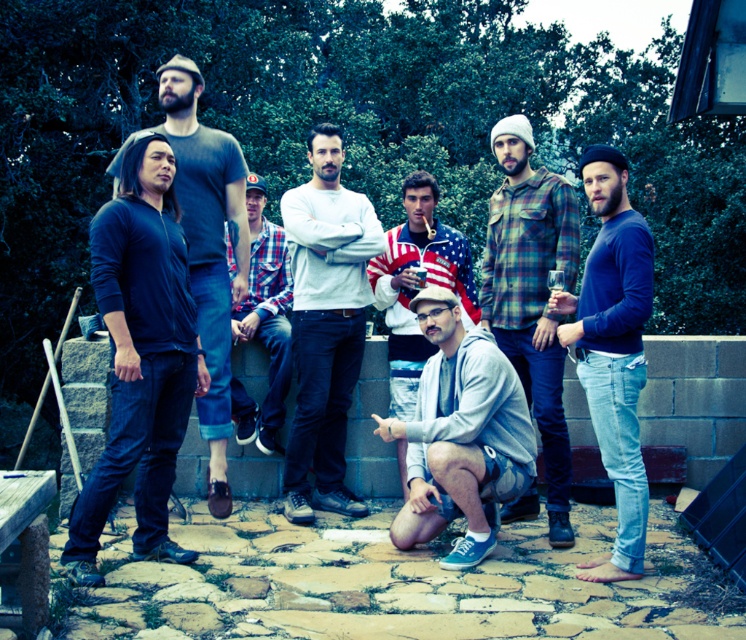
This screenshot has width=746, height=640. Describe the element at coordinates (140, 356) in the screenshot. I see `dark blue sweater at left` at that location.

In the scene shown: Between dark blue sweater at left and plaid flannel shirt at center, which one is positioned lower?

dark blue sweater at left is below.

Between point (95, 554) and point (514, 296), which one is positioned in front?

Positioned in front is point (95, 554).

The width and height of the screenshot is (746, 640). I want to click on dark blue sweater at left, so click(140, 356).

Is white matte sweater at center below plaid fabric shirt at center?

Yes, white matte sweater at center is below plaid fabric shirt at center.

In the scene shown: Can you confirm if white matte sweater at center is taller than plaid fabric shirt at center?

Correct, white matte sweater at center is much taller as plaid fabric shirt at center.

Which is behind, point (330, 420) or point (283, 336)?

The point (283, 336) is more distant.

Find the location of a particular element. white matte sweater at center is located at coordinates (325, 323).

Identify the location of gray fleece jacket at center. Image resolution: width=746 pixels, height=640 pixels. (460, 435).

Is gray fleece jacket at center shorter than dark gray t-shirt at left?

Indeed, gray fleece jacket at center has a lesser height compared to dark gray t-shirt at left.

The image size is (746, 640). I want to click on gray fleece jacket at center, so click(460, 435).